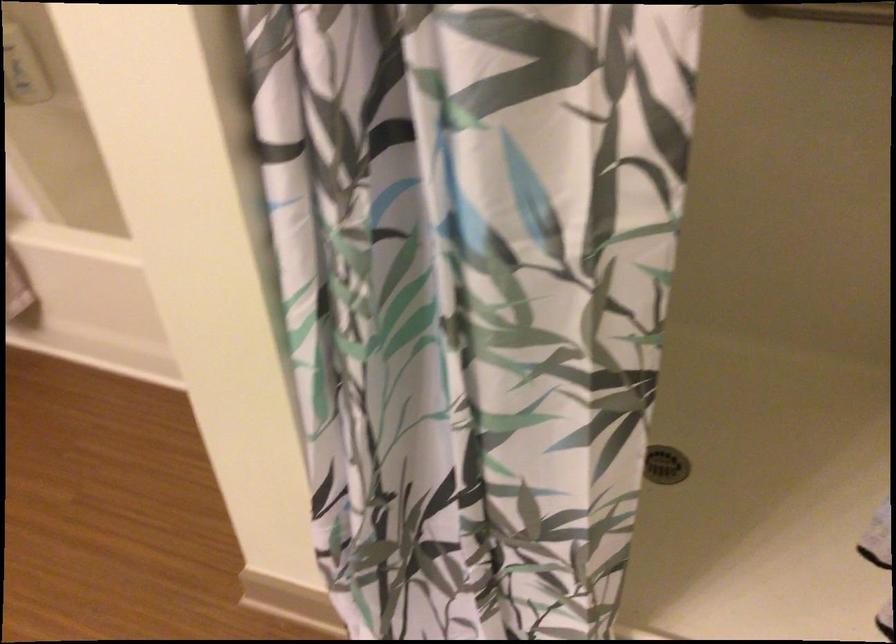
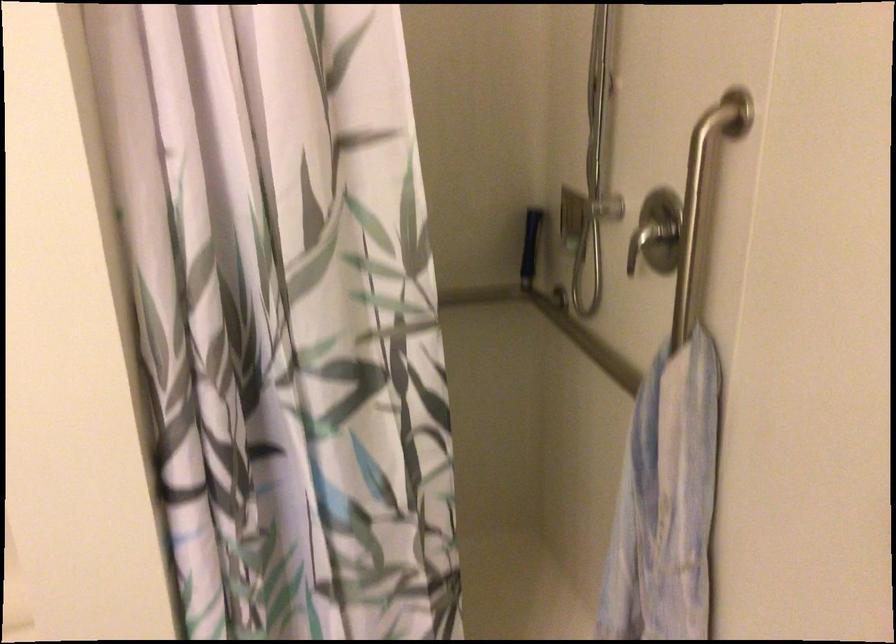
Question: How did the camera likely rotate?

Choices:
 (A) Left
 (B) Right
 (C) Up
 (D) Down

Answer: (B)